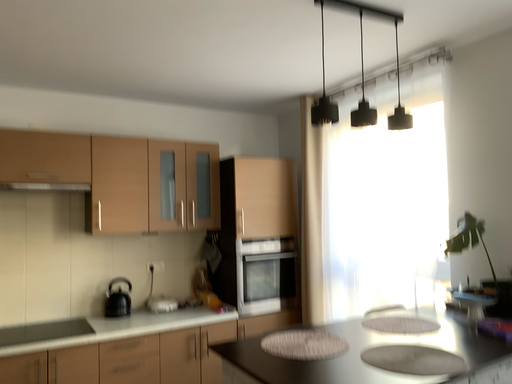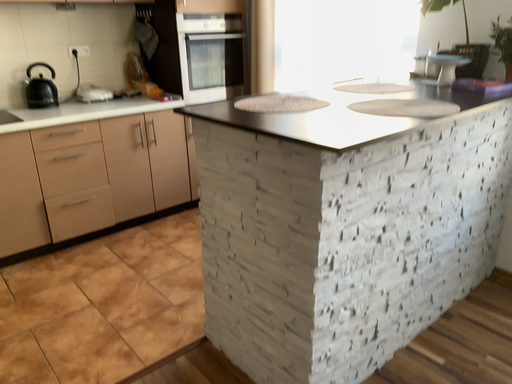
Question: Which way did the camera rotate in the video?

Choices:
 (A) rotated upward
 (B) rotated downward

Answer: (B)